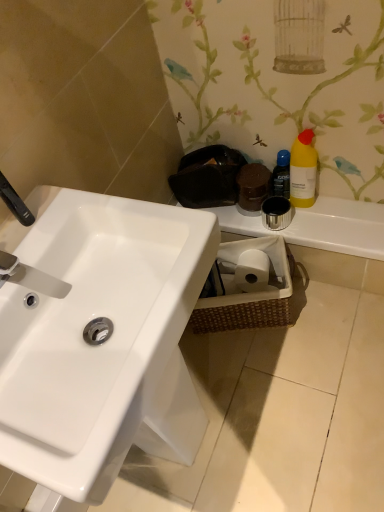
This screenshot has height=512, width=384. I want to click on free space in front of yellow matte bottle at upper right, so click(x=335, y=223).